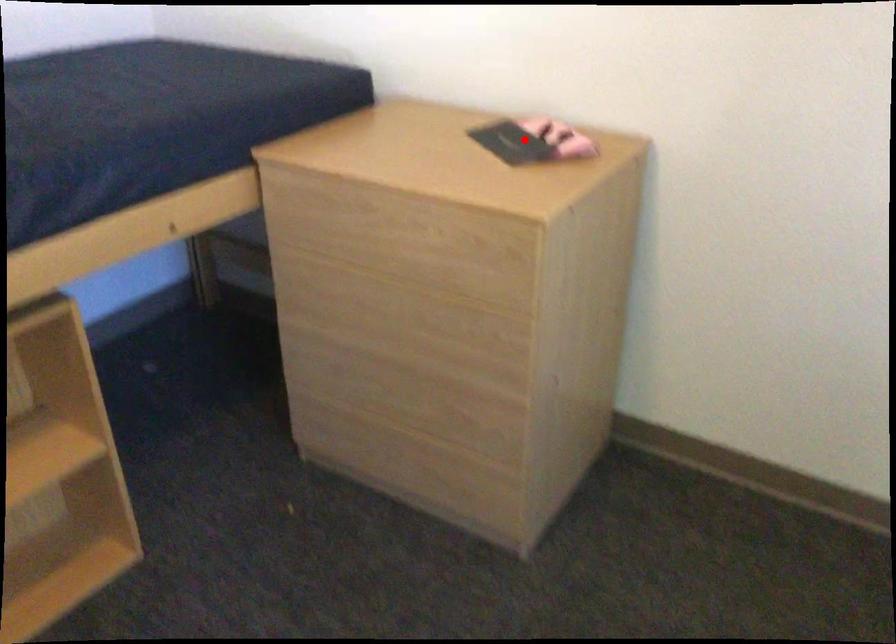
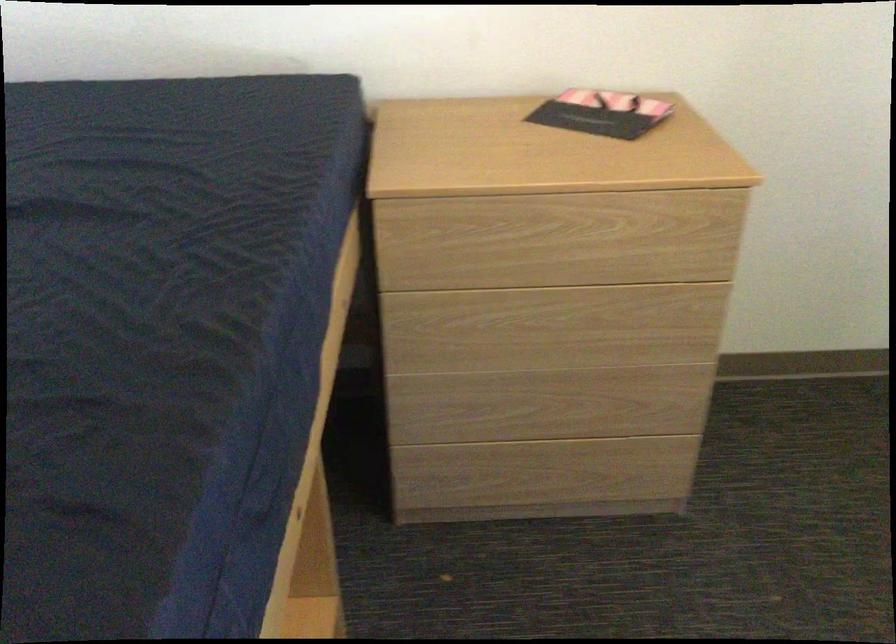
Where in the second image is the point corresponding to the highlighted location from the first image?

(600, 113)